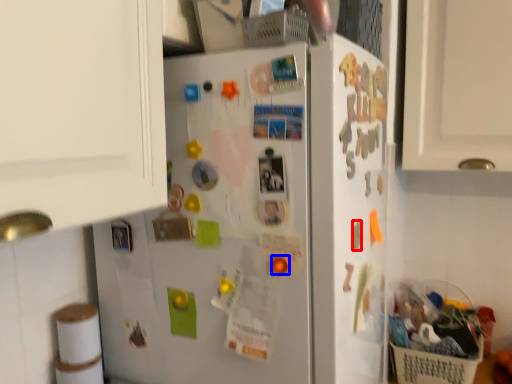
Question: Which object appears farthest to the camera in this image, magnet (highlighted by a red box) or magnet (highlighted by a blue box)?

Choices:
 (A) magnet
 (B) magnet

Answer: (A)